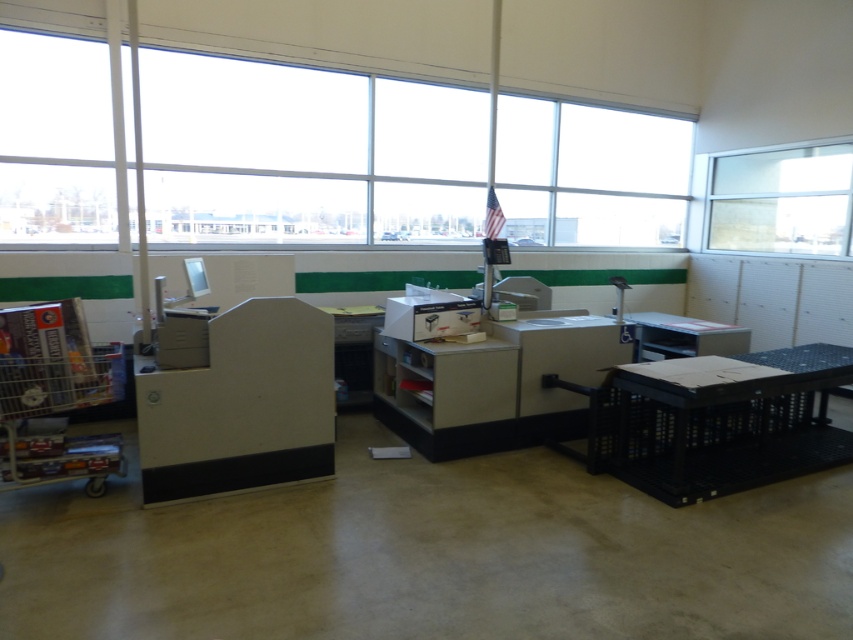
Question: Does clear glass window at upper right have a lesser width compared to matte gray table at right?

Choices:
 (A) no
 (B) yes

Answer: (B)

Question: Which point is closer to the camera taking this photo?

Choices:
 (A) (294, 81)
 (B) (634, 353)
 (C) (798, 200)

Answer: (B)

Question: Among these objects, which one is farthest from the camera?

Choices:
 (A) matte gray table at right
 (B) clear glass window at upper right
 (C) transparent glass window at upper center

Answer: (B)

Question: Is the position of transparent glass window at upper center less distant than that of clear glass window at upper right?

Choices:
 (A) no
 (B) yes

Answer: (B)

Question: Estimate the real-world distances between objects in this image. Which object is closer to the transparent glass window at upper center?

Choices:
 (A) matte gray table at right
 (B) clear glass window at upper right

Answer: (A)

Question: Is clear glass window at upper right positioned before matte gray table at right?

Choices:
 (A) yes
 (B) no

Answer: (B)